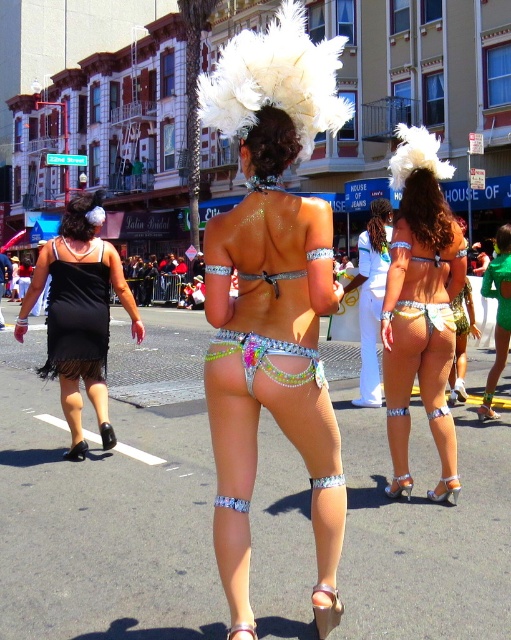
You are a photographer trying to capture the fishnet bikini at center and the shiny silver sandal at lower center in the same frame. Which object will appear closer to the camera in your photo?

The fishnet bikini at center will appear closer to the camera because it is positioned over the shiny silver sandal at lower center, indicating it is in front of it in the scene.

You are a photographer trying to capture the vibrant costumes of the women in the image. You notice the fishnet bikini at center and the multicolored sequined bikini bottom at center. Which of these two items has a greater width in the image?

The fishnet bikini at center has a greater width than the multicolored sequined bikini bottom at center according to the description.

From the picture: You are a photographer trying to capture the black satin bikini at left and the black patent leather sandal at lower left in the same frame. Which object should you focus on first to ensure both are in the shot?

The black satin bikini at left is positioned on the left side of the black patent leather sandal at lower left, so you should focus on the black patent leather sandal at lower left first to include both in the frame.